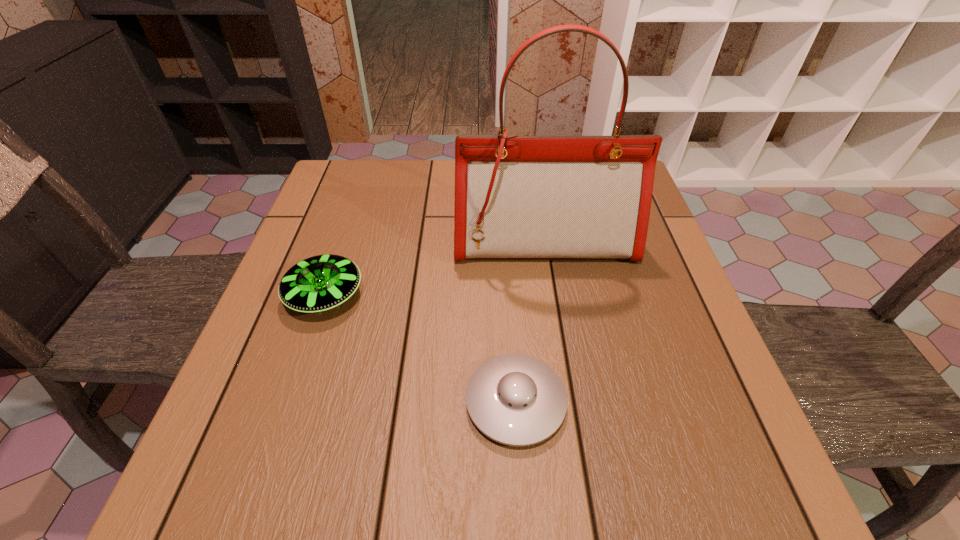
You are a GUI agent. You are given a task and a screenshot of the screen. Output one action in this format:
    pyautogui.click(x=<x>, y=<y>)
    Task: Click on the object located at the right edge
    The width and height of the screenshot is (960, 540).
    Given the screenshot: What is the action you would take?
    pyautogui.click(x=517, y=197)

The image size is (960, 540). Find the location of `vacant space at the near edge of the desktop`. vacant space at the near edge of the desktop is located at coordinates (507, 506).

Locate an element on the screen. vacant region at the left edge of the desktop is located at coordinates (287, 444).

The image size is (960, 540). What are the coordinates of `free space at the right edge of the desktop` in the screenshot? It's located at (625, 311).

Locate an element on the screen. Image resolution: width=960 pixels, height=540 pixels. vacant space at the far left corner of the desktop is located at coordinates (314, 206).

You are a GUI agent. You are given a task and a screenshot of the screen. Output one action in this format:
    pyautogui.click(x=<x>, y=<y>)
    Task: Click on the free space at the near right corner of the desktop
    Image resolution: width=960 pixels, height=540 pixels.
    Given the screenshot: What is the action you would take?
    pyautogui.click(x=781, y=513)

Locate an element on the screen. The width and height of the screenshot is (960, 540). unoccupied position between the tallest object and the shortest object is located at coordinates (530, 323).

What are the coordinates of `vacant area that lies between the left saucer and the shortest object` in the screenshot? It's located at (420, 349).

This screenshot has width=960, height=540. What are the coordinates of `blank region between the shorter saucer and the tallest object` in the screenshot? It's located at (530, 323).

Locate an element on the screen. empty location between the handbag and the shorter saucer is located at coordinates (530, 323).